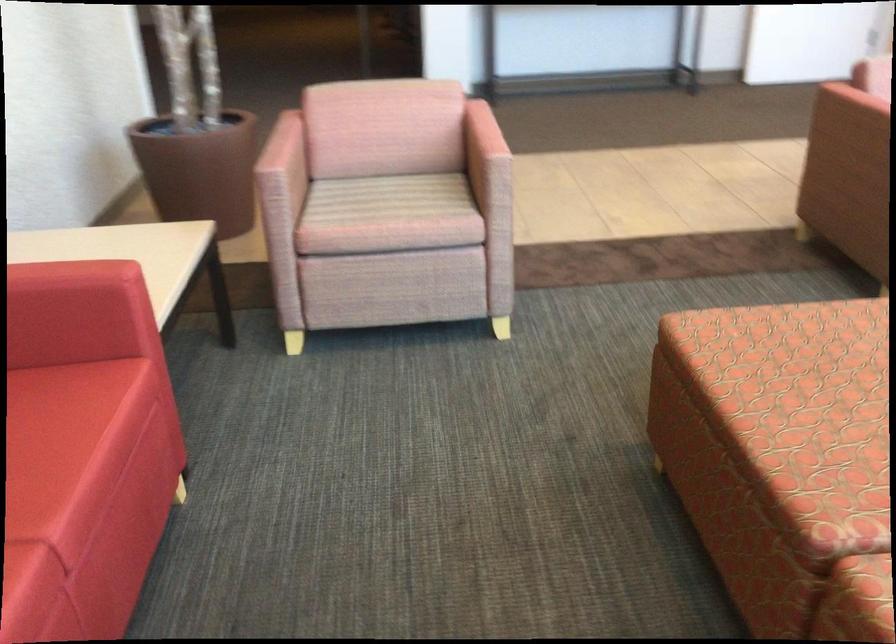
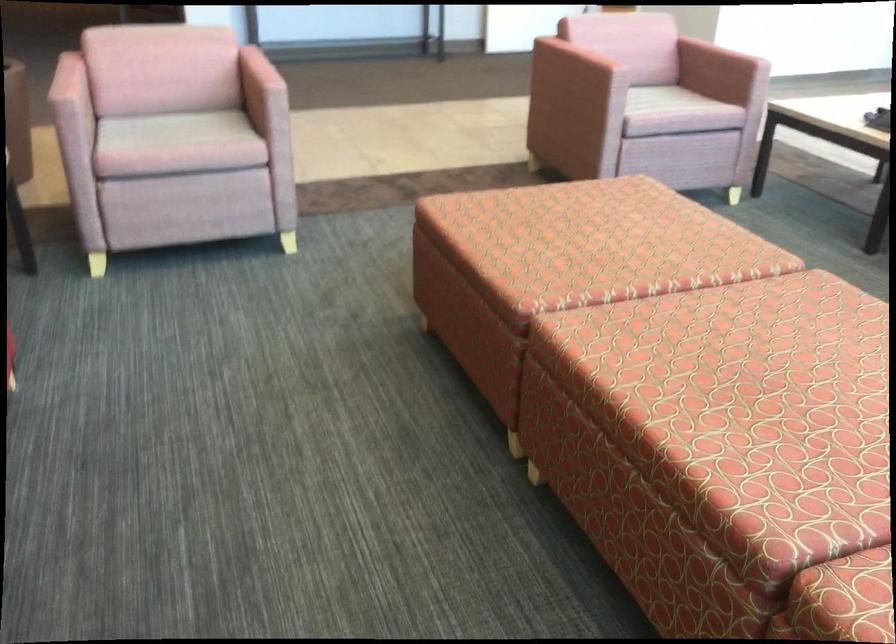
Question: Which direction would the cameraman need to move to produce the second image? Reply with the corresponding letter.

Choices:
 (A) Left
 (B) Right
 (C) Forward
 (D) Backward

Answer: (D)